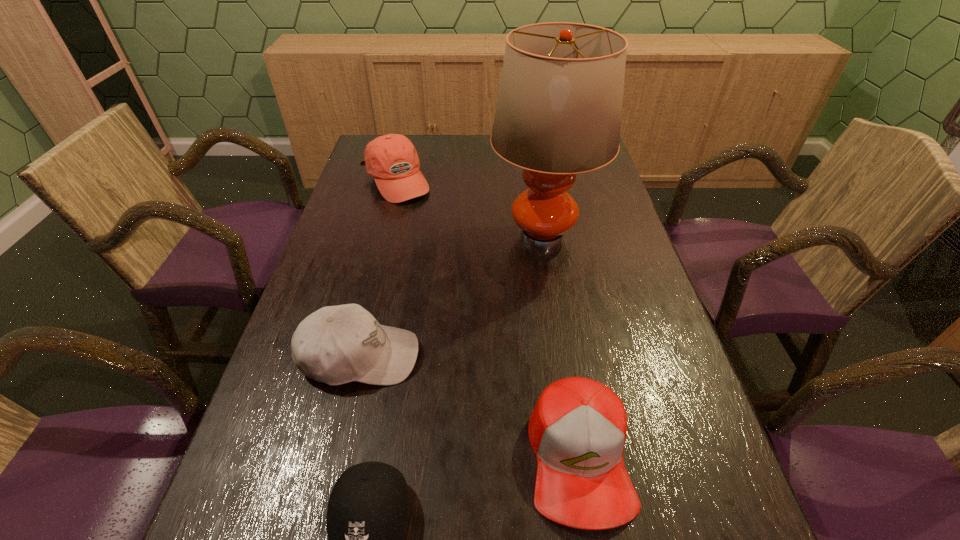
Identify the location of the tallest object. The height and width of the screenshot is (540, 960). (558, 113).

Locate an element on the screen. the farthest baseball cap is located at coordinates (392, 159).

What are the coordinates of `the third nearest baseball cap` in the screenshot? It's located at tap(335, 345).

I want to click on the rightmost baseball cap, so click(578, 428).

This screenshot has height=540, width=960. Find the location of `blank space located on the back of the lamp`. blank space located on the back of the lamp is located at coordinates (530, 157).

Find the location of a particular element. The height and width of the screenshot is (540, 960). free space located 0.370m on the front of the farthest baseball cap is located at coordinates (367, 295).

Where is `vacant area situated 0.160m on the front-facing side of the third nearest object`? This screenshot has width=960, height=540. vacant area situated 0.160m on the front-facing side of the third nearest object is located at coordinates (496, 356).

Where is `object present at the far edge`? This screenshot has width=960, height=540. object present at the far edge is located at coordinates (392, 159).

At what (x,y) coordinates should I click in order to perform the action: click on lamp situated at the right edge. Please return your answer as a coordinate pair (x, y). The width and height of the screenshot is (960, 540). Looking at the image, I should click on (558, 113).

Where is `baseball cap present at the right edge`? Image resolution: width=960 pixels, height=540 pixels. baseball cap present at the right edge is located at coordinates (578, 428).